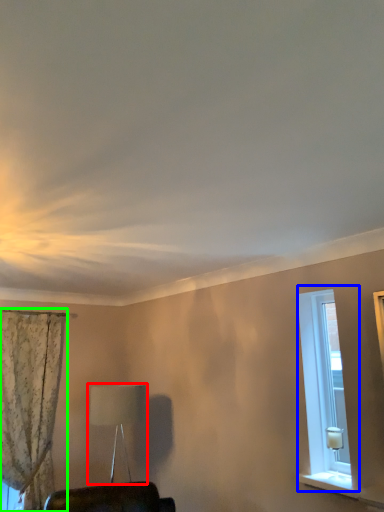
Question: Which is nearer to the table lamp (highlighted by a red box)? window (highlighted by a blue box) or curtain (highlighted by a green box).

Choices:
 (A) window
 (B) curtain

Answer: (B)